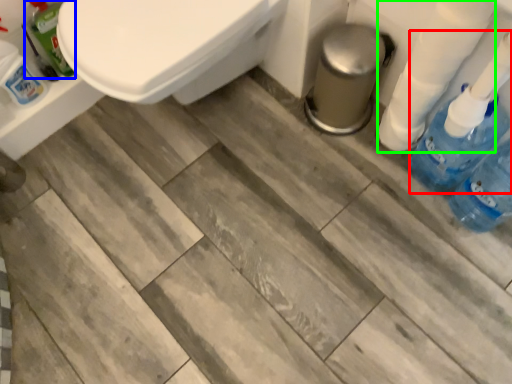
Question: Which object is positioned closest to cleaning product (highlighted by a red box)? Select from cleaning product (highlighted by a blue box) and toilet paper (highlighted by a green box).

Choices:
 (A) cleaning product
 (B) toilet paper

Answer: (B)